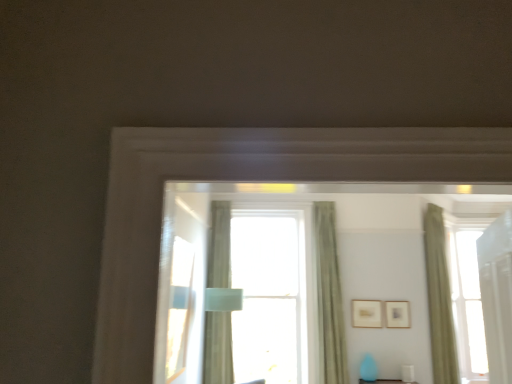
Question: Is wooden picture frame at upper right, the first picture frame when ordered from left to right, to the left or to the right of green textured curtain at center, arranged as the second curtain when viewed from the right, in the image?

Choices:
 (A) left
 (B) right

Answer: (B)

Question: From the image's perspective, is wooden picture frame at upper right, which is the 2th picture frame from right to left, above or below green textured curtain at center, arranged as the second curtain when viewed from the right?

Choices:
 (A) below
 (B) above

Answer: (A)

Question: Estimate the real-world distances between objects in this image. Which object is closer to the silky green curtain at center, the first curtain in the left-to-right sequence?

Choices:
 (A) wooden picture frame at upper right, which is the 2th picture frame from right to left
 (B) matte gold picture frame at upper center, positioned as the 1th picture frame in right-to-left order
 (C) clear glass window at center
 (D) green textured curtain at center, placed as the 2th curtain when sorted from left to right
 (E) green fabric curtain at right, acting as the 1th curtain starting from the right

Answer: (C)

Question: Which of these objects is positioned farthest from the green fabric curtain at right, arranged as the third curtain when viewed from the left?

Choices:
 (A) wooden picture frame at upper right, which is the 2th picture frame from right to left
 (B) silky green curtain at center, placed as the 3th curtain when sorted from right to left
 (C) matte gold picture frame at upper center, the 2th picture frame in the left-to-right sequence
 (D) clear glass window at center
 (E) green textured curtain at center, arranged as the second curtain when viewed from the right

Answer: (B)